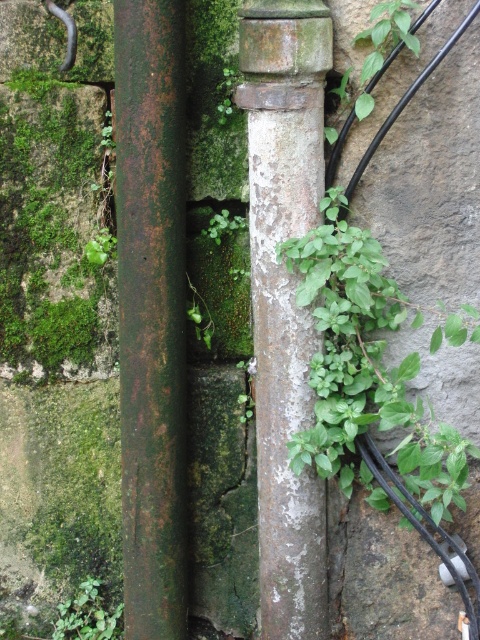
You are standing in front of the stone wall and want to touch both the rusty metal pole at center and the green matte plant at lower left. Which object should you reach for first to touch the one closer to you?

The rusty metal pole at center is closer to the viewer than the green matte plant at lower left, so you should reach for the rusty metal pole at center first.

You are a maintenance worker standing 2 meters away from a wall with a rusty metal pole at center. Can you reach the pole without moving closer?

The rusty metal pole at center is 1.93 meters from the camera, so you are standing 2 meters away. Since the distance is slightly farther than the pole, you cannot reach it without moving closer.